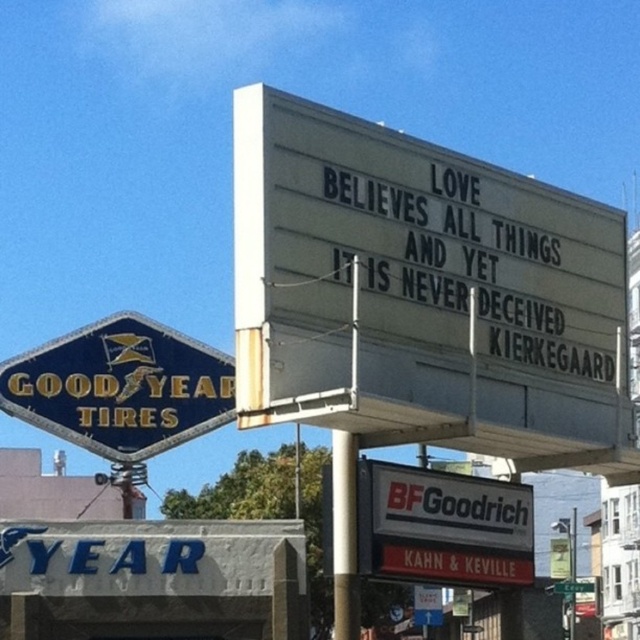
Question: Which point is closer to the camera?

Choices:
 (A) (476, 376)
 (B) (58, 362)

Answer: (A)

Question: Is white plastic signboard at upper center bigger than goldmaterial/texturegood year tires at upper left?

Choices:
 (A) yes
 (B) no

Answer: (A)

Question: Among these points, which one is nearest to the camera?

Choices:
 (A) (122, 380)
 (B) (336, 248)

Answer: (B)

Question: Can you confirm if white plastic signboard at upper center is positioned below goldmaterial/texturegood year tires at upper left?

Choices:
 (A) yes
 (B) no

Answer: (B)

Question: Does white plastic signboard at upper center have a larger size compared to goldmaterial/texturegood year tires at upper left?

Choices:
 (A) no
 (B) yes

Answer: (B)